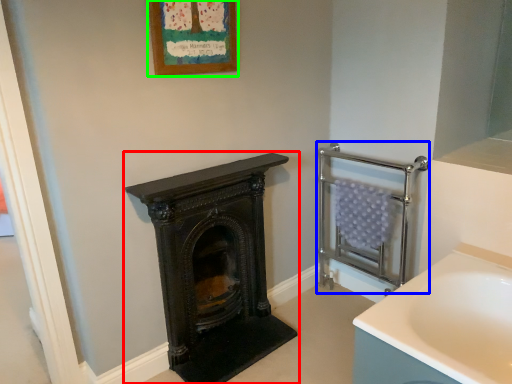
Question: Estimate the real-world distances between objects in this image. Which object is closer to wood burning stove (highlighted by a red box), balustrade (highlighted by a blue box) or picture frame (highlighted by a green box)?

Choices:
 (A) balustrade
 (B) picture frame

Answer: (A)